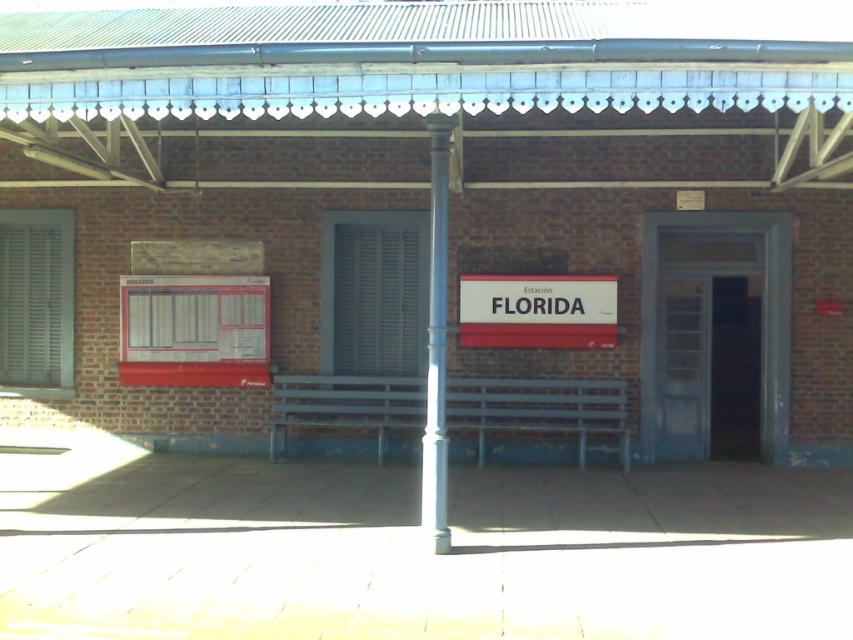
Question: Does blue metallic bench at center appear under metallic gray pole at center?

Choices:
 (A) yes
 (B) no

Answer: (A)

Question: Which object is closer to the camera taking this photo?

Choices:
 (A) metallic gray pole at center
 (B) white matte shutter at center
 (C) white matte sign at center

Answer: (A)

Question: Is white matte sign at center below metallic gray pole at center?

Choices:
 (A) no
 (B) yes

Answer: (A)

Question: Among these points, which one is nearest to the camera?

Choices:
 (A) (599, 314)
 (B) (431, 161)

Answer: (B)

Question: Can you confirm if white matte shutter at center is positioned below metallic gray pole at center?

Choices:
 (A) no
 (B) yes

Answer: (A)

Question: Which of the following is the closest to the observer?

Choices:
 (A) metallic gray pole at center
 (B) white matte shutter at center

Answer: (A)